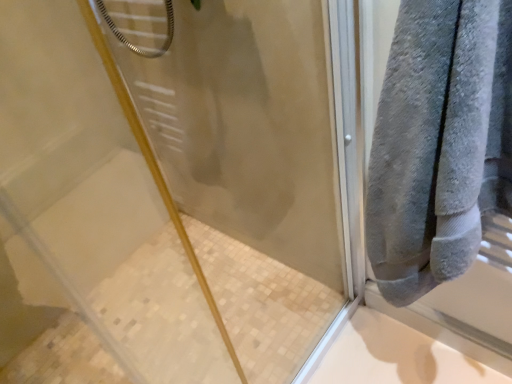
Question: Should I look upward or downward to see transparent glass shower door at upper right?

Choices:
 (A) up
 (B) down

Answer: (B)

Question: Does gray soft towel at right lie in front of transparent glass shower door at upper right?

Choices:
 (A) no
 (B) yes

Answer: (A)

Question: From a real-world perspective, is gray soft towel at right under transparent glass shower door at upper right?

Choices:
 (A) yes
 (B) no

Answer: (B)

Question: Is gray soft towel at right wider than transparent glass shower door at upper right?

Choices:
 (A) no
 (B) yes

Answer: (B)

Question: Does gray soft towel at right have a larger size compared to transparent glass shower door at upper right?

Choices:
 (A) yes
 (B) no

Answer: (B)

Question: Is the surface of gray soft towel at right in direct contact with transparent glass shower door at upper right?

Choices:
 (A) yes
 (B) no

Answer: (B)

Question: Can you confirm if gray soft towel at right is positioned to the right of transparent glass shower door at upper right?

Choices:
 (A) no
 (B) yes

Answer: (B)

Question: Is there a large distance between transparent glass shower door at upper right and gray soft towel at right?

Choices:
 (A) yes
 (B) no

Answer: (B)

Question: Is transparent glass shower door at upper right smaller than gray soft towel at right?

Choices:
 (A) yes
 (B) no

Answer: (B)

Question: Does transparent glass shower door at upper right appear on the left side of gray soft towel at right?

Choices:
 (A) no
 (B) yes

Answer: (B)

Question: Is transparent glass shower door at upper right oriented towards gray soft towel at right?

Choices:
 (A) yes
 (B) no

Answer: (A)

Question: From the image's perspective, does transparent glass shower door at upper right appear lower than gray soft towel at right?

Choices:
 (A) no
 (B) yes

Answer: (B)

Question: From a real-world perspective, is transparent glass shower door at upper right physically above gray soft towel at right?

Choices:
 (A) yes
 (B) no

Answer: (B)

Question: Is point (40, 299) positioned closer to the camera than point (448, 69)?

Choices:
 (A) closer
 (B) farther

Answer: (B)